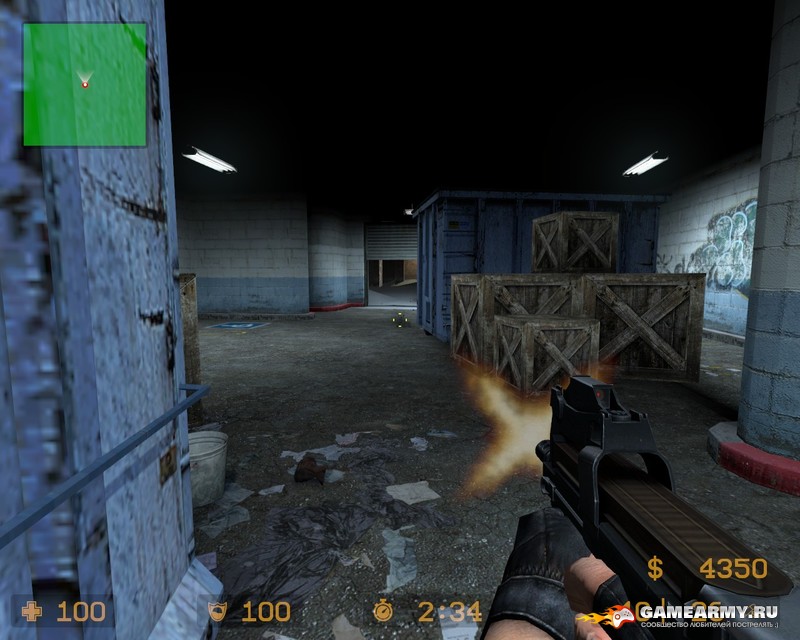
Where is `concrete walls`? concrete walls is located at coordinates (776, 282), (717, 246), (337, 246), (253, 246).